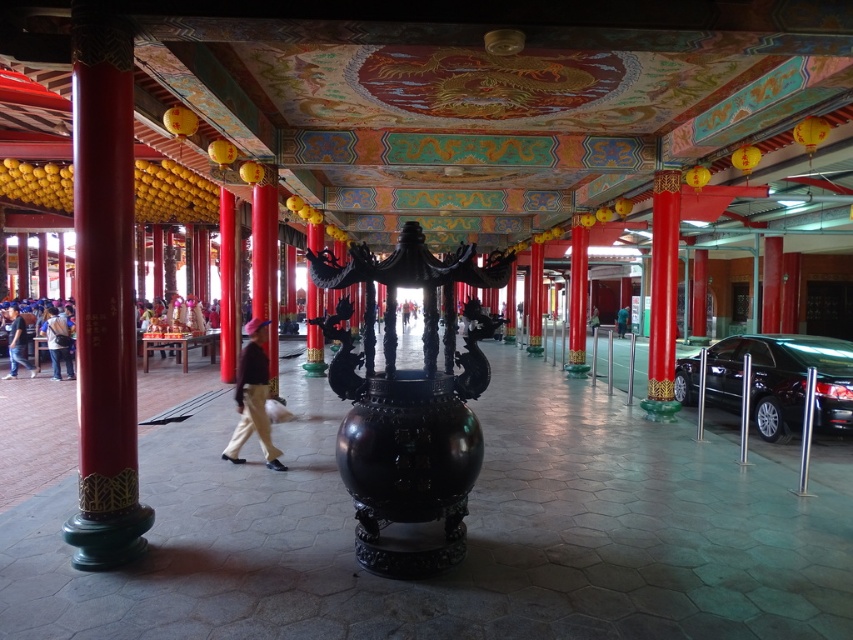
Question: Does glossy red pole at left appear on the right side of shiny red pillar at center?

Choices:
 (A) yes
 (B) no

Answer: (B)

Question: Can you confirm if shiny red pole at right is positioned above khaki pants at center?

Choices:
 (A) no
 (B) yes

Answer: (B)

Question: Among these points, which one is farthest from the camera?

Choices:
 (A) (624, 310)
 (B) (592, 316)
 (C) (419, 266)

Answer: (B)

Question: Can you confirm if glossy red pole at left is positioned to the left of black metallic car at right?

Choices:
 (A) yes
 (B) no

Answer: (A)

Question: Which point appears closest to the camera in this image?

Choices:
 (A) (430, 301)
 (B) (244, 356)

Answer: (A)

Question: Which is farther from the black polished vase at center?

Choices:
 (A) glossy red pole at left
 (B) shiny red pole at center
 (C) shiny red pillar at center

Answer: (B)